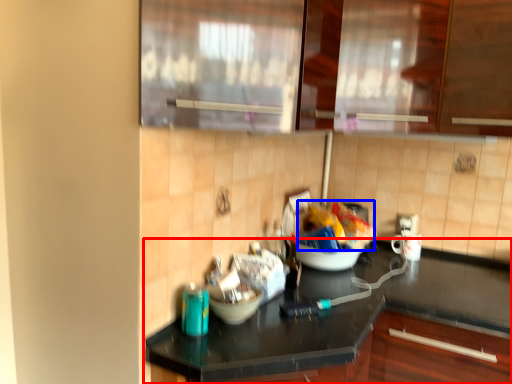
Question: Which object appears farthest to the camera in this image, countertop (highlighted by a red box) or food (highlighted by a blue box)?

Choices:
 (A) countertop
 (B) food

Answer: (B)